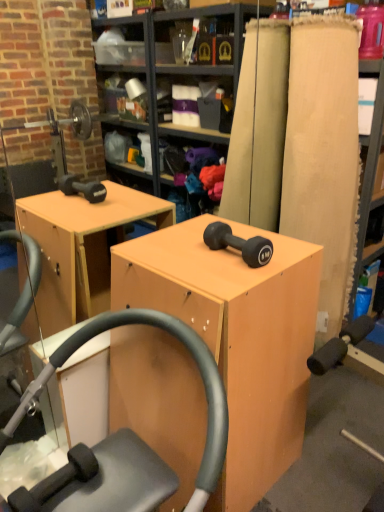
This screenshot has width=384, height=512. Find the location of `vacant area located to the right-hand side of matte black dumbbell at center`. vacant area located to the right-hand side of matte black dumbbell at center is located at coordinates (288, 252).